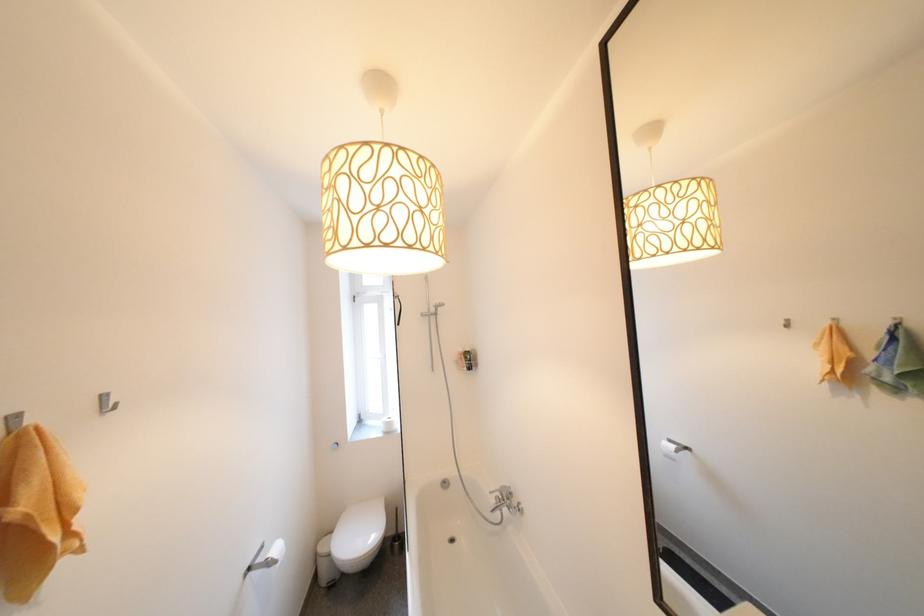
This screenshot has height=616, width=924. Describe the element at coordinates (324, 562) in the screenshot. I see `the white trash can` at that location.